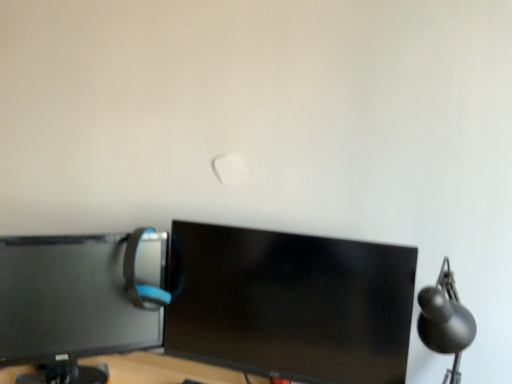
Identify the location of matte gray computer chair at left. pos(141,284).

Describe the element at coordinates (289, 304) in the screenshot. I see `black glossy monitor at center, the first computer monitor when ordered from right to left` at that location.

You are a GUI agent. You are given a task and a screenshot of the screen. Output one action in this format:
    pyautogui.click(x=<x>, y=<y>)
    Task: Click on the matte gray computer chair at left
    This screenshot has width=512, height=384.
    Given the screenshot: What is the action you would take?
    pyautogui.click(x=141, y=284)

Consider the image. Can we say matte black monitor at left, the first computer monitor positioned from the left, lies outside black glossy monitor at center, arranged as the second computer monitor when viewed from the left?

matte black monitor at left, the first computer monitor positioned from the left, lies outside black glossy monitor at center, arranged as the second computer monitor when viewed from the left,'s area.

Is matte black monitor at left, the first computer monitor positioned from the left, oriented towards black glossy monitor at center, the first computer monitor when ordered from right to left?

No, matte black monitor at left, the first computer monitor positioned from the left, is not facing towards black glossy monitor at center, the first computer monitor when ordered from right to left.

Between matte black monitor at left, marked as the 2th computer monitor in a right-to-left arrangement, and black glossy monitor at center, the first computer monitor when ordered from right to left, which one has larger width?

Wider between the two is matte black monitor at left, marked as the 2th computer monitor in a right-to-left arrangement.

Does matte gray computer chair at left have a lesser height compared to black glossy monitor at center, the first computer monitor when ordered from right to left?

Yes, matte gray computer chair at left is shorter than black glossy monitor at center, the first computer monitor when ordered from right to left.

Is matte gray computer chair at left situated inside black glossy monitor at center, the first computer monitor when ordered from right to left, or outside?

matte gray computer chair at left lies outside black glossy monitor at center, the first computer monitor when ordered from right to left.

From a real-world perspective, relative to black glossy monitor at center, arranged as the second computer monitor when viewed from the left, is matte gray computer chair at left vertically above or below?

matte gray computer chair at left is situated higher than black glossy monitor at center, arranged as the second computer monitor when viewed from the left, in the real world.

Based on the photo, could you measure the distance between matte gray computer chair at left and black glossy monitor at center, arranged as the second computer monitor when viewed from the left?

11.07 inches.

Is black glossy monitor at center, arranged as the second computer monitor when viewed from the left, to the left or to the right of matte gray computer chair at left in the image?

Based on their positions, black glossy monitor at center, arranged as the second computer monitor when viewed from the left, is located to the right of matte gray computer chair at left.

Would you consider black glossy monitor at center, the first computer monitor when ordered from right to left, to be distant from matte gray computer chair at left?

No, black glossy monitor at center, the first computer monitor when ordered from right to left, is in close proximity to matte gray computer chair at left.

Considering the sizes of objects black glossy monitor at center, the first computer monitor when ordered from right to left, and matte gray computer chair at left in the image provided, who is wider, black glossy monitor at center, the first computer monitor when ordered from right to left, or matte gray computer chair at left?

Result: Wider between the two is matte gray computer chair at left.

Is matte gray computer chair at left taller than matte black monitor at left, marked as the 2th computer monitor in a right-to-left arrangement?

No, matte gray computer chair at left is not taller than matte black monitor at left, marked as the 2th computer monitor in a right-to-left arrangement.

In the image, is matte gray computer chair at left positioned in front of or behind matte black monitor at left, marked as the 2th computer monitor in a right-to-left arrangement?

matte gray computer chair at left is behind matte black monitor at left, marked as the 2th computer monitor in a right-to-left arrangement.

Is matte gray computer chair at left thinner than matte black monitor at left, the first computer monitor positioned from the left?

Yes.

How different are the orientations of black matte table lamp at right and matte black monitor at left, the first computer monitor positioned from the left, in degrees?

The facing directions of black matte table lamp at right and matte black monitor at left, the first computer monitor positioned from the left, are 42.8 degrees apart.

Is black matte table lamp at right in contact with matte black monitor at left, marked as the 2th computer monitor in a right-to-left arrangement?

No.

Locate an element on the screen. The image size is (512, 384). the 2nd computer monitor counting from the left side of the black matte table lamp at right is located at coordinates (80, 299).

Which is nearer, (x=473, y=334) or (x=72, y=321)?

Clearly, point (x=473, y=334) is closer to the camera than point (x=72, y=321).

In the scene shown: Is matte black monitor at left, the first computer monitor positioned from the left, situated inside matte gray computer chair at left or outside?

matte black monitor at left, the first computer monitor positioned from the left, is located beyond the bounds of matte gray computer chair at left.

Based on the photo, are matte black monitor at left, marked as the 2th computer monitor in a right-to-left arrangement, and matte gray computer chair at left beside each other?

matte black monitor at left, marked as the 2th computer monitor in a right-to-left arrangement, and matte gray computer chair at left are clearly separated.

Considering the positions of point (157, 297) and point (156, 308), is point (157, 297) closer or farther from the camera than point (156, 308)?

Point (157, 297) is positioned closer to the camera compared to point (156, 308).

Can you tell me how much matte black monitor at left, marked as the 2th computer monitor in a right-to-left arrangement, and matte gray computer chair at left differ in facing direction?

54.6 degrees separate the facing orientations of matte black monitor at left, marked as the 2th computer monitor in a right-to-left arrangement, and matte gray computer chair at left.

Is black matte table lamp at right completely or partially inside matte gray computer chair at left?

→ No, black matte table lamp at right is not a part of matte gray computer chair at left.

Between matte gray computer chair at left and black matte table lamp at right, which one has less height?

Standing shorter between the two is matte gray computer chair at left.

Consider the image. How many degrees apart are the facing directions of matte gray computer chair at left and black matte table lamp at right?

97.4 degrees separate the facing orientations of matte gray computer chair at left and black matte table lamp at right.

Identify the location of computer monitor that is below the matte black monitor at left, marked as the 2th computer monitor in a right-to-left arrangement (from the image's perspective). (289, 304).

Identify the location of computer chair located behind the black glossy monitor at center, the first computer monitor when ordered from right to left. (141, 284).

Estimate the real-world distances between objects in this image. Which object is closer to matte black monitor at left, the first computer monitor positioned from the left, black matte table lamp at right or matte gray computer chair at left?

matte gray computer chair at left lies closer to matte black monitor at left, the first computer monitor positioned from the left, than the other object.

Looking at the image, which one is located closer to black matte table lamp at right, black glossy monitor at center, arranged as the second computer monitor when viewed from the left, or matte gray computer chair at left?

The object closer to black matte table lamp at right is black glossy monitor at center, arranged as the second computer monitor when viewed from the left.

Looking at the image, which one is located further to black glossy monitor at center, the first computer monitor when ordered from right to left, black matte table lamp at right or matte gray computer chair at left?

black matte table lamp at right.

When comparing their distances from matte gray computer chair at left, does black glossy monitor at center, the first computer monitor when ordered from right to left, or black matte table lamp at right seem further?

Based on the image, black matte table lamp at right appears to be further to matte gray computer chair at left.

Based on their spatial positions, is black matte table lamp at right or matte black monitor at left, the first computer monitor positioned from the left, closer to black glossy monitor at center, the first computer monitor when ordered from right to left?

matte black monitor at left, the first computer monitor positioned from the left, is closer to black glossy monitor at center, the first computer monitor when ordered from right to left.

Estimate the real-world distances between objects in this image. Which object is further from matte gray computer chair at left, black glossy monitor at center, arranged as the second computer monitor when viewed from the left, or matte black monitor at left, marked as the 2th computer monitor in a right-to-left arrangement?

black glossy monitor at center, arranged as the second computer monitor when viewed from the left, is positioned further to the anchor matte gray computer chair at left.

Looking at the image, which one is located closer to black glossy monitor at center, arranged as the second computer monitor when viewed from the left, matte black monitor at left, marked as the 2th computer monitor in a right-to-left arrangement, or matte gray computer chair at left?

Based on the image, matte black monitor at left, marked as the 2th computer monitor in a right-to-left arrangement, appears to be nearer to black glossy monitor at center, arranged as the second computer monitor when viewed from the left.

Considering their positions, is matte black monitor at left, marked as the 2th computer monitor in a right-to-left arrangement, positioned closer to black matte table lamp at right than black glossy monitor at center, arranged as the second computer monitor when viewed from the left?

The object closer to black matte table lamp at right is black glossy monitor at center, arranged as the second computer monitor when viewed from the left.

Locate an element on the screen. This screenshot has width=512, height=384. computer monitor between matte gray computer chair at left and black matte table lamp at right from left to right is located at coordinates (289, 304).

This screenshot has height=384, width=512. Find the location of `computer chair between matte black monitor at left, the first computer monitor positioned from the left, and black matte table lamp at right from left to right`. computer chair between matte black monitor at left, the first computer monitor positioned from the left, and black matte table lamp at right from left to right is located at coordinates (141, 284).

The image size is (512, 384). In order to click on computer monitor located between matte black monitor at left, marked as the 2th computer monitor in a right-to-left arrangement, and black matte table lamp at right in the left-right direction in this screenshot , I will do `click(289, 304)`.

The image size is (512, 384). I want to click on computer chair located between matte black monitor at left, marked as the 2th computer monitor in a right-to-left arrangement, and black glossy monitor at center, arranged as the second computer monitor when viewed from the left, in the left-right direction, so click(x=141, y=284).